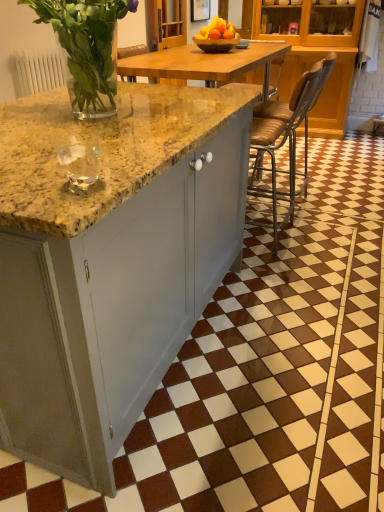
Question: Can we say metallic brown bar stool at center lies outside wooden bowl at center?

Choices:
 (A) no
 (B) yes

Answer: (B)

Question: Is metallic brown bar stool at center smaller than wooden bowl at center?

Choices:
 (A) no
 (B) yes

Answer: (A)

Question: Does metallic brown bar stool at center turn towards wooden bowl at center?

Choices:
 (A) no
 (B) yes

Answer: (A)

Question: Is metallic brown bar stool at center not near wooden bowl at center?

Choices:
 (A) yes
 (B) no

Answer: (B)

Question: Considering the relative sizes of metallic brown bar stool at center and wooden bowl at center in the image provided, is metallic brown bar stool at center shorter than wooden bowl at center?

Choices:
 (A) yes
 (B) no

Answer: (B)

Question: Is metallic brown bar stool at center inside or outside of clear glass vase at upper left?

Choices:
 (A) inside
 (B) outside

Answer: (B)

Question: From a real-world perspective, is metallic brown bar stool at center positioned above or below clear glass vase at upper left?

Choices:
 (A) above
 (B) below

Answer: (B)

Question: Considering the relative positions of metallic brown bar stool at center and clear glass vase at upper left in the image provided, is metallic brown bar stool at center to the left or to the right of clear glass vase at upper left?

Choices:
 (A) left
 (B) right

Answer: (B)

Question: Considering their positions, is metallic brown bar stool at center located in front of or behind clear glass vase at upper left?

Choices:
 (A) behind
 (B) front

Answer: (A)

Question: From the image's perspective, is clear glass at left positioned above or below clear glass vase at upper left?

Choices:
 (A) below
 (B) above

Answer: (A)

Question: Is clear glass at left taller or shorter than clear glass vase at upper left?

Choices:
 (A) short
 (B) tall

Answer: (A)

Question: Choose the correct answer: Is clear glass at left inside clear glass vase at upper left or outside it?

Choices:
 (A) outside
 (B) inside

Answer: (A)

Question: Considering their positions, is clear glass at left located in front of or behind clear glass vase at upper left?

Choices:
 (A) behind
 (B) front

Answer: (B)

Question: Looking at the image, does clear glass vase at upper left seem bigger or smaller compared to matte gray cabinet at center?

Choices:
 (A) big
 (B) small

Answer: (B)

Question: From the image's perspective, is clear glass vase at upper left positioned above or below matte gray cabinet at center?

Choices:
 (A) above
 (B) below

Answer: (A)